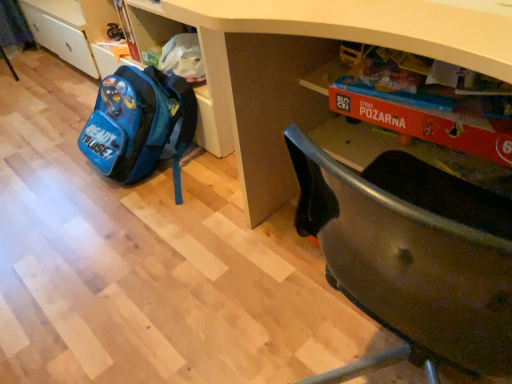
Question: Is white matte desk at center taller or shorter than blue fabric backpack at lower left?

Choices:
 (A) short
 (B) tall

Answer: (B)

Question: Looking at the image, does white matte desk at center seem bigger or smaller compared to blue fabric backpack at lower left?

Choices:
 (A) big
 (B) small

Answer: (A)

Question: Is white matte desk at center to the left or to the right of blue fabric backpack at lower left in the image?

Choices:
 (A) left
 (B) right

Answer: (B)

Question: Is blue fabric backpack at lower left to the left or to the right of white matte desk at center in the image?

Choices:
 (A) right
 (B) left

Answer: (B)

Question: In the image, is blue fabric backpack at lower left positioned in front of or behind white matte desk at center?

Choices:
 (A) behind
 (B) front

Answer: (A)

Question: From the image's perspective, is blue fabric backpack at lower left located above or below white matte desk at center?

Choices:
 (A) below
 (B) above

Answer: (B)

Question: Considering the positions of point (117, 69) and point (256, 43), is point (117, 69) closer or farther from the camera than point (256, 43)?

Choices:
 (A) farther
 (B) closer

Answer: (A)